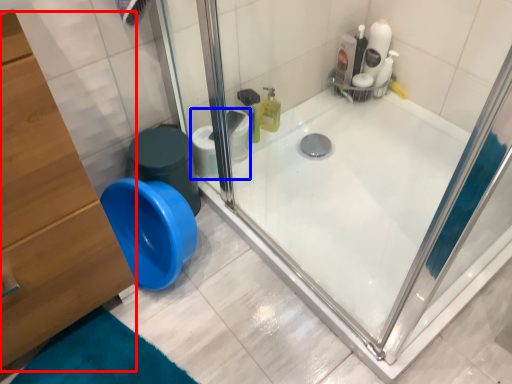
Question: Which point is further to the camera, dresser (highlighted by a red box) or toilet paper (highlighted by a blue box)?

Choices:
 (A) dresser
 (B) toilet paper

Answer: (B)